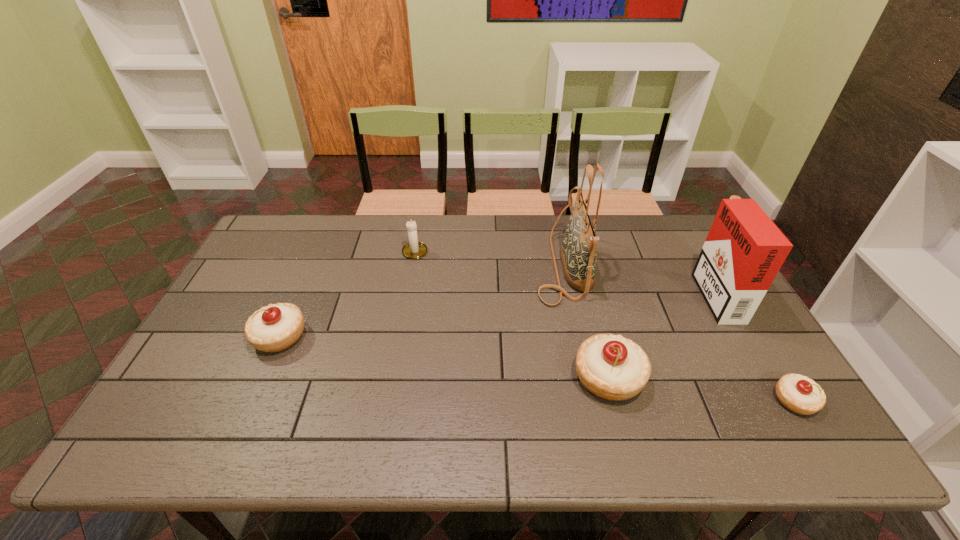
At what (x,y) coordinates should I click in order to perform the action: click on empty space that is in between the rightmost pastry and the fifth object from right to left. Please return your answer as a coordinate pair (x, y). The width and height of the screenshot is (960, 540). Looking at the image, I should click on (605, 326).

Select which object appears as the fourth closest to the second pastry from left to right. Please provide its 2D coordinates. Your answer should be formatted as a tuple, i.e. [(x, y)], where the tuple contains the x and y coordinates of a point satisfying the conditions above.

[(413, 250)]

This screenshot has width=960, height=540. In order to click on object identified as the fourth closest to the second pastry from right to left in this screenshot , I will do `click(413, 250)`.

Locate which pastry ranks in proximity to the second pastry from left to right. Please provide its 2D coordinates. Your answer should be formatted as a tuple, i.e. [(x, y)], where the tuple contains the x and y coordinates of a point satisfying the conditions above.

[(799, 394)]

Identify which pastry is located as the nearest to the cigarette case. Please provide its 2D coordinates. Your answer should be formatted as a tuple, i.e. [(x, y)], where the tuple contains the x and y coordinates of a point satisfying the conditions above.

[(799, 394)]

Image resolution: width=960 pixels, height=540 pixels. Find the location of `vacant space that satisfies the following two spatial constraints: 1. on the front-facing side of the handbag; 2. on the left side of the rightmost pastry`. vacant space that satisfies the following two spatial constraints: 1. on the front-facing side of the handbag; 2. on the left side of the rightmost pastry is located at coordinates (591, 401).

At what (x,y) coordinates should I click in order to perform the action: click on free spot that satisfies the following two spatial constraints: 1. on the front-facing side of the cigarette case; 2. on the right side of the shortest pastry. Please return your answer as a coordinate pair (x, y). Looking at the image, I should click on (776, 401).

You are a GUI agent. You are given a task and a screenshot of the screen. Output one action in this format:
    pyautogui.click(x=<x>, y=<y>)
    Task: Click on the free space that satisfies the following two spatial constraints: 1. on the front side of the shortest pastry; 2. on the left side of the leftmost object
    This screenshot has width=960, height=540.
    Given the screenshot: What is the action you would take?
    pyautogui.click(x=252, y=401)